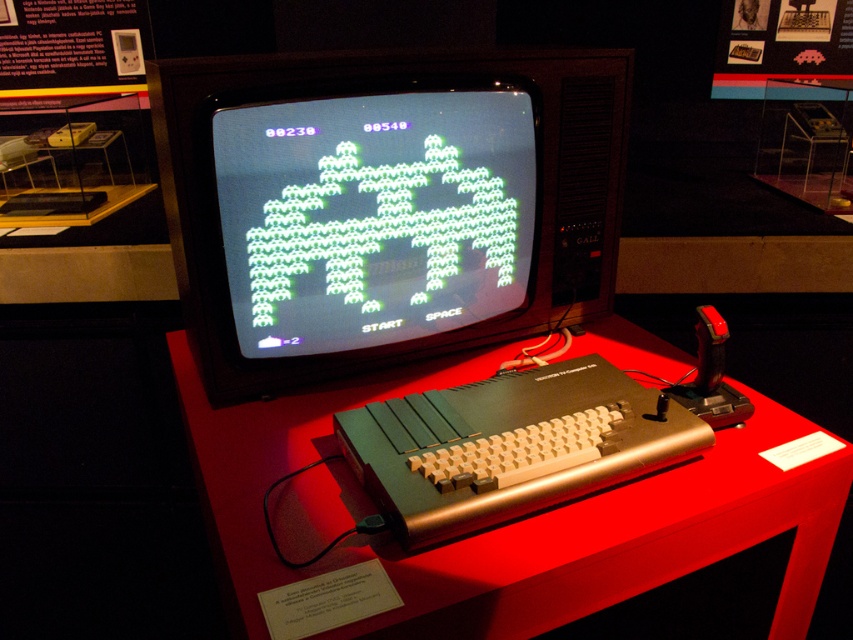
Question: Can you confirm if black plastic monitor at center is wider than metallic red table at center?

Choices:
 (A) no
 (B) yes

Answer: (A)

Question: Does black plastic monitor at center appear on the left side of metallic red table at center?

Choices:
 (A) yes
 (B) no

Answer: (A)

Question: Among these objects, which one is farthest from the camera?

Choices:
 (A) metallic red table at center
 (B) black plastic monitor at center

Answer: (B)

Question: Among these objects, which one is farthest from the camera?

Choices:
 (A) metallic red table at center
 (B) black plastic monitor at center

Answer: (B)

Question: Which of the following is the farthest from the observer?

Choices:
 (A) metallic red table at center
 (B) black plastic monitor at center

Answer: (B)

Question: In this image, where is black plastic monitor at center located relative to metallic red table at center?

Choices:
 (A) above
 (B) below

Answer: (A)